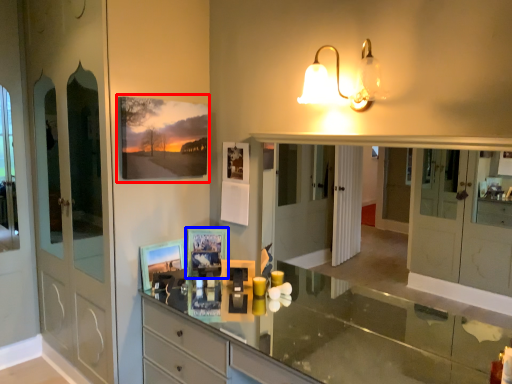
Question: Among these objects, which one is farthest to the camera, picture frame (highlighted by a red box) or picture frame (highlighted by a blue box)?

Choices:
 (A) picture frame
 (B) picture frame

Answer: (B)